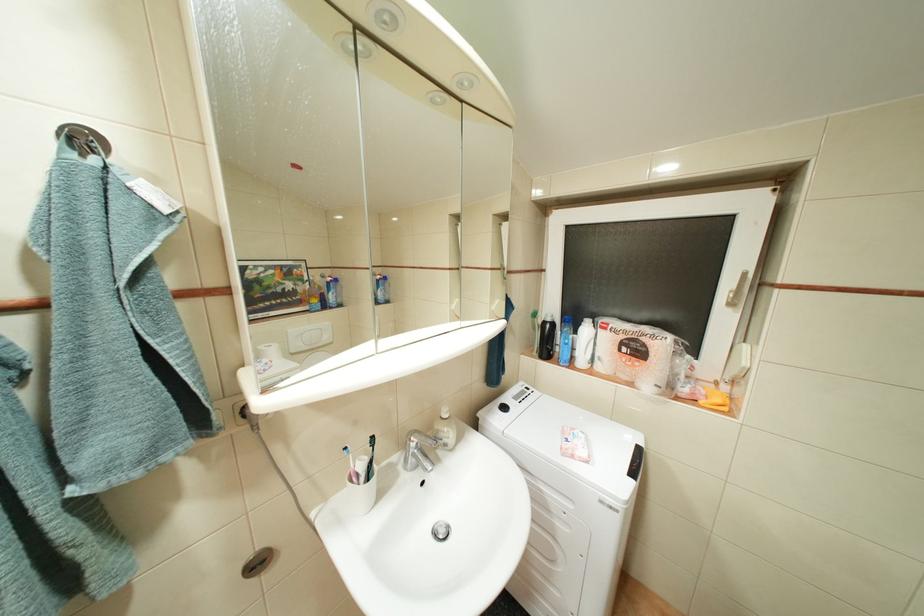
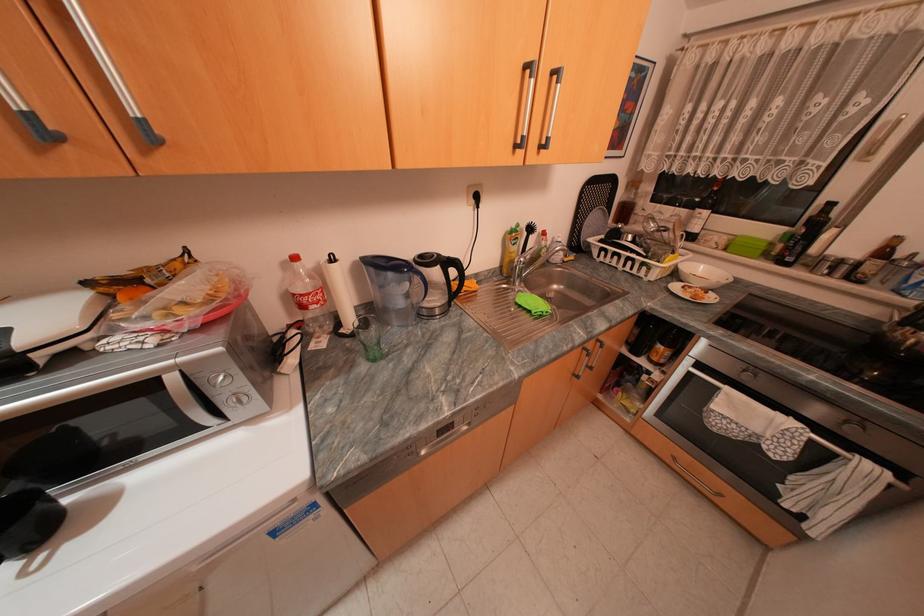
What movement of the cameraman would produce the second image?

The movement direction of the cameraman is right, backward.